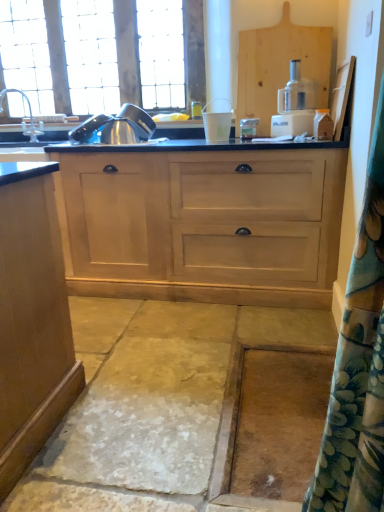
Find the location of a particular element. vacant space in white plastic cup at center, placed as the second appliance when sorted from left to right (from a real-world perspective) is located at coordinates (216, 142).